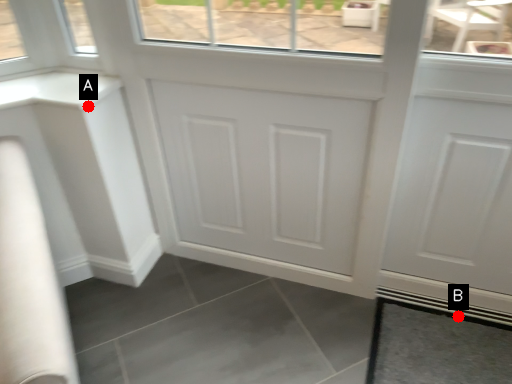
Question: Two points are circled on the image, labeled by A and B beside each circle. Which point appears farthest from the camera in this image?

Choices:
 (A) A is further
 (B) B is further

Answer: (B)